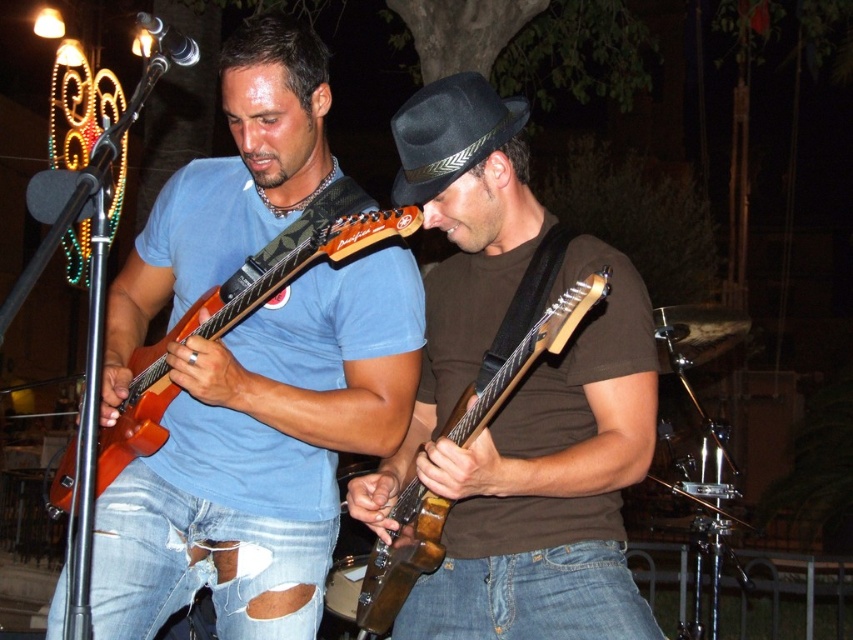
Question: Is orange matte electric guitar at center bigger than wooden electric guitar at center?

Choices:
 (A) no
 (B) yes

Answer: (B)

Question: Can you confirm if orange matte electric guitar at center is positioned to the right of denim jeans at lower center?

Choices:
 (A) yes
 (B) no

Answer: (B)

Question: Which object is the closest to the denim jeans at lower center?

Choices:
 (A) wooden electric guitar at center
 (B) ripped denim jeans at lower left
 (C) orange matte electric guitar at center

Answer: (A)

Question: Estimate the real-world distances between objects in this image. Which object is closer to the wooden electric guitar at center?

Choices:
 (A) denim jeans at lower center
 (B) black felt fedora at center
 (C) orange matte electric guitar at center

Answer: (A)

Question: Based on their relative distances, which object is nearer to the orange matte electric guitar at center?

Choices:
 (A) wooden electric guitar at center
 (B) black felt fedora at center
 (C) denim jeans at lower center
 (D) ripped denim jeans at lower left

Answer: (D)

Question: Is ripped denim jeans at lower left wider than denim jeans at lower center?

Choices:
 (A) no
 (B) yes

Answer: (B)